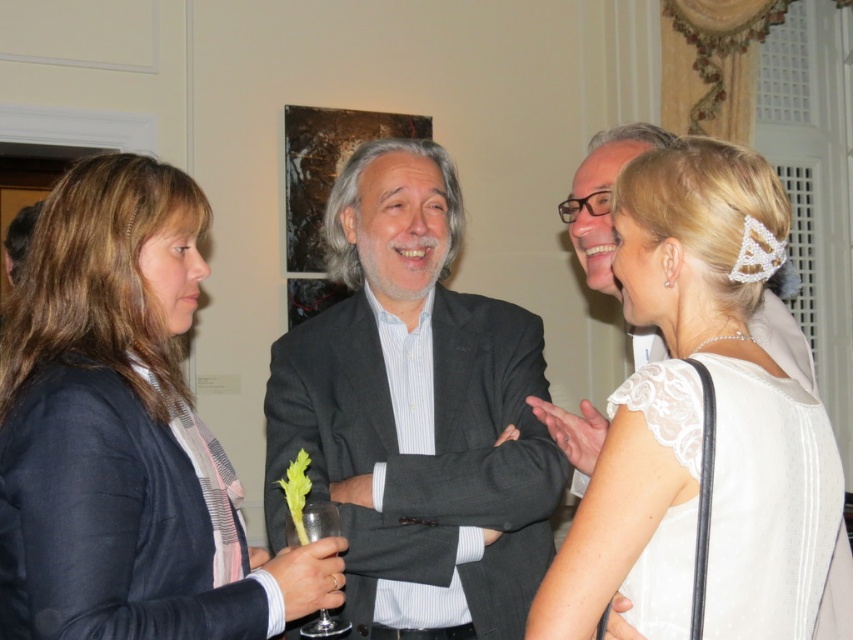
You are standing in front of the group of four individuals at the formal event. You want to take a photo that includes both the point at coordinate (828, 467) and the point at coordinate (305, 504). Which point should you focus on to ensure both are in focus?

You should focus on point (305, 504) because it is farther from the camera than point (828, 467), and focusing on the farther point will keep both in focus.

You are a photographer at this event and want to capture a photo of both the matte black blazer at left and the white lace dress at center in the same frame. The camera you are using has a minimum focus distance of 28 inches. Do you need to move closer or farther away to ensure both are in focus?

The matte black blazer at left and white lace dress at center are 27.77 inches apart, which is less than the camera minimum focus distance of 28 inches. Therefore, you need to move closer to reduce the distance between the subjects to ensure both are in focus.